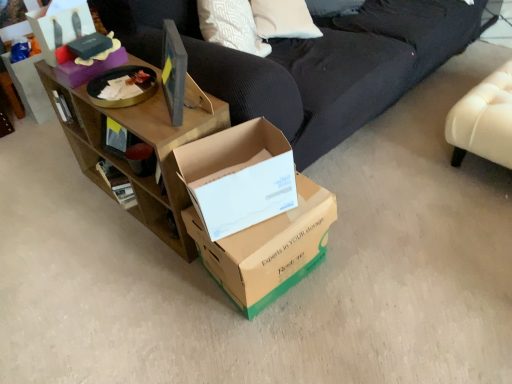
Question: Does leather ottoman at right have a lesser width compared to brown wood shelf at upper left?

Choices:
 (A) no
 (B) yes

Answer: (A)

Question: Could brown wood shelf at upper left be considered to be inside leather ottoman at right?

Choices:
 (A) yes
 (B) no

Answer: (B)

Question: Could you tell me if leather ottoman at right is facing brown wood shelf at upper left?

Choices:
 (A) no
 (B) yes

Answer: (A)

Question: Can you confirm if leather ottoman at right is bigger than brown wood shelf at upper left?

Choices:
 (A) yes
 (B) no

Answer: (B)

Question: From a real-world perspective, is leather ottoman at right located beneath brown wood shelf at upper left?

Choices:
 (A) no
 (B) yes

Answer: (B)

Question: Is leather ottoman at right taller than brown wood shelf at upper left?

Choices:
 (A) yes
 (B) no

Answer: (B)

Question: Considering the relative sizes of brown wood shelf at upper left and leather ottoman at right in the image provided, is brown wood shelf at upper left taller than leather ottoman at right?

Choices:
 (A) no
 (B) yes

Answer: (B)

Question: Could leather ottoman at right be considered to be inside brown wood shelf at upper left?

Choices:
 (A) no
 (B) yes

Answer: (A)

Question: Are brown wood shelf at upper left and leather ottoman at right far apart?

Choices:
 (A) no
 (B) yes

Answer: (B)

Question: Does brown wood shelf at upper left come behind leather ottoman at right?

Choices:
 (A) no
 (B) yes

Answer: (A)

Question: From a real-world perspective, is brown wood shelf at upper left located higher than leather ottoman at right?

Choices:
 (A) no
 (B) yes

Answer: (B)

Question: Is brown wood shelf at upper left to the left of leather ottoman at right from the viewer's perspective?

Choices:
 (A) no
 (B) yes

Answer: (B)

Question: Does brown cardboard box at center, the 3th box from the top, have a larger size compared to brown wood shelf at upper left?

Choices:
 (A) yes
 (B) no

Answer: (B)